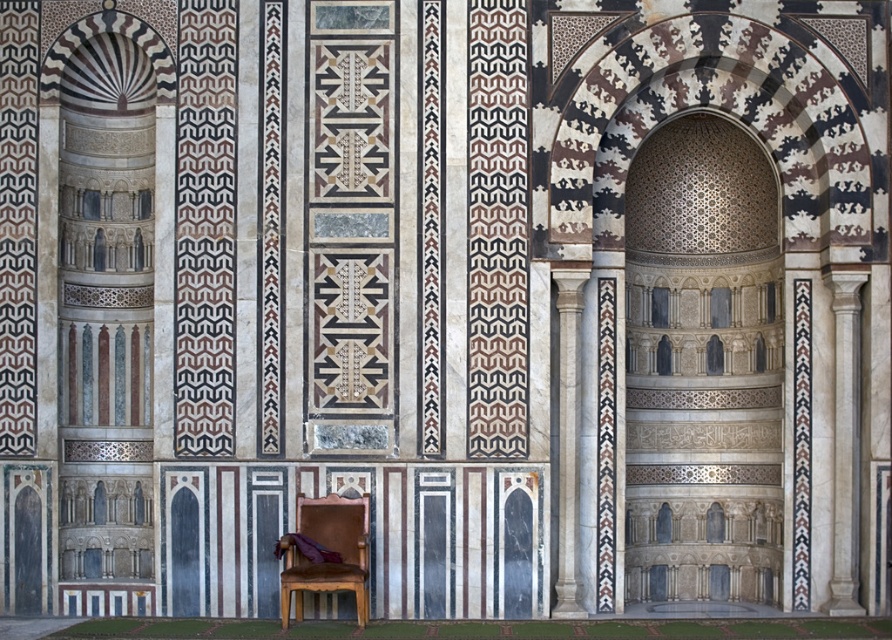
Question: Is brown leather armchair at lower center positioned in front of white marble column at center?

Choices:
 (A) no
 (B) yes

Answer: (B)

Question: Among these points, which one is nearest to the camera?

Choices:
 (A) (298, 577)
 (B) (572, 465)

Answer: (A)

Question: Observing the image, what is the correct spatial positioning of brown leather armchair at lower center in reference to white marble column at center?

Choices:
 (A) left
 (B) right

Answer: (A)

Question: Is brown leather armchair at lower center to the left of white marble column at center from the viewer's perspective?

Choices:
 (A) yes
 (B) no

Answer: (A)